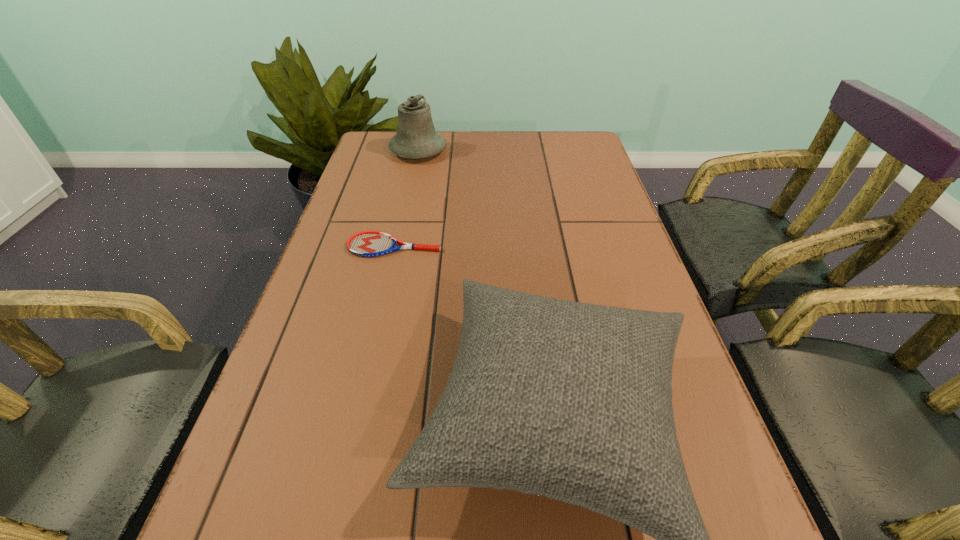
What are the coordinates of `vacant space at the left edge` in the screenshot? It's located at (361, 183).

Where is `free spot at the right edge of the desktop`? free spot at the right edge of the desktop is located at coordinates (598, 269).

In the image, there is a desktop. In order to click on vacant space at the far right corner in this screenshot , I will do `click(554, 133)`.

You are a GUI agent. You are given a task and a screenshot of the screen. Output one action in this format:
    pyautogui.click(x=<x>, y=<y>)
    Task: Click on the unoccupied position between the bell and the second farthest object
    
    Given the screenshot: What is the action you would take?
    pyautogui.click(x=406, y=198)

This screenshot has width=960, height=540. In order to click on vacant area between the shortest object and the farthest object in this screenshot , I will do `click(406, 198)`.

Find the location of a particular element. This screenshot has height=540, width=960. unoccupied area between the bell and the tennis racket is located at coordinates (406, 198).

You are a GUI agent. You are given a task and a screenshot of the screen. Output one action in this format:
    pyautogui.click(x=<x>, y=<y>)
    Task: Click on the vacant space in between the bell and the second nearest object
    The image size is (960, 540).
    Given the screenshot: What is the action you would take?
    pyautogui.click(x=406, y=198)

The image size is (960, 540). What are the coordinates of `object that is the closest to the nearest object` in the screenshot? It's located at (367, 243).

Point out which object is positioned as the second nearest to the farthest object. Please provide its 2D coordinates. Your answer should be formatted as a tuple, i.e. [(x, y)], where the tuple contains the x and y coordinates of a point satisfying the conditions above.

[(572, 401)]

Identify the location of vacant point that satisfies the following two spatial constraints: 1. on the back side of the farthest object; 2. on the left side of the shortest object. (416, 151).